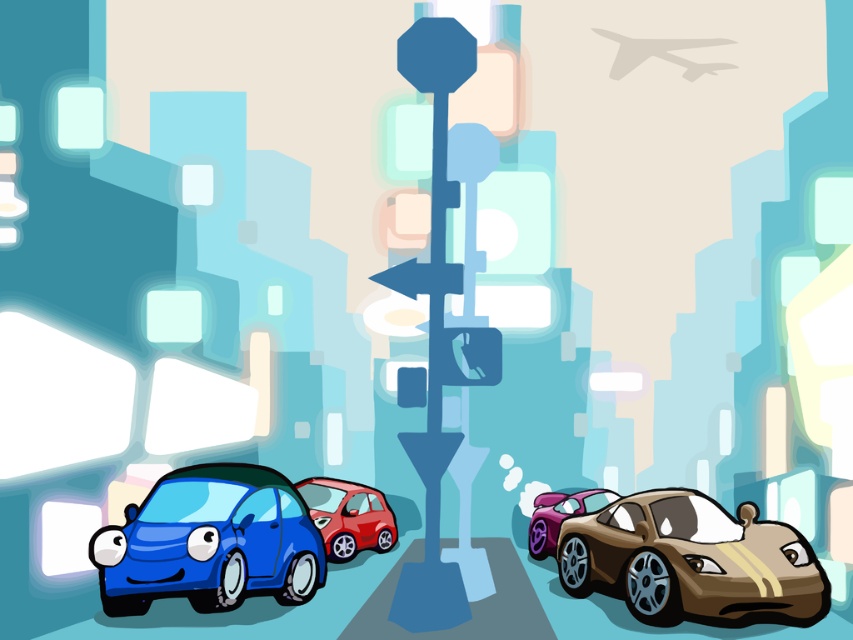
Who is shorter, shiny gold sports car at lower right or glossy red car at center?

Standing shorter between the two is glossy red car at center.

Can you confirm if shiny gold sports car at lower right is positioned below glossy red car at center?

Incorrect, shiny gold sports car at lower right is not positioned below glossy red car at center.

Who is more distant from viewer, (708, 584) or (375, 531)?

The point (375, 531) is more distant.

Identify the location of shiny gold sports car at lower right. (692, 561).

Can you confirm if shiny gold sports car at lower right is shorter than purple metallic sports car at right?

In fact, shiny gold sports car at lower right may be taller than purple metallic sports car at right.

Is point (575, 516) farther from camera compared to point (527, 544)?

No, it is not.

I want to click on shiny gold sports car at lower right, so click(x=692, y=561).

Who is lower down, glossy red car at center or purple metallic sports car at right?

purple metallic sports car at right is lower down.

Which is in front, point (335, 561) or point (613, 492)?

Point (335, 561) is in front.

Which is in front, point (312, 506) or point (532, 554)?

Point (312, 506)

The height and width of the screenshot is (640, 853). I want to click on glossy red car at center, so click(x=347, y=515).